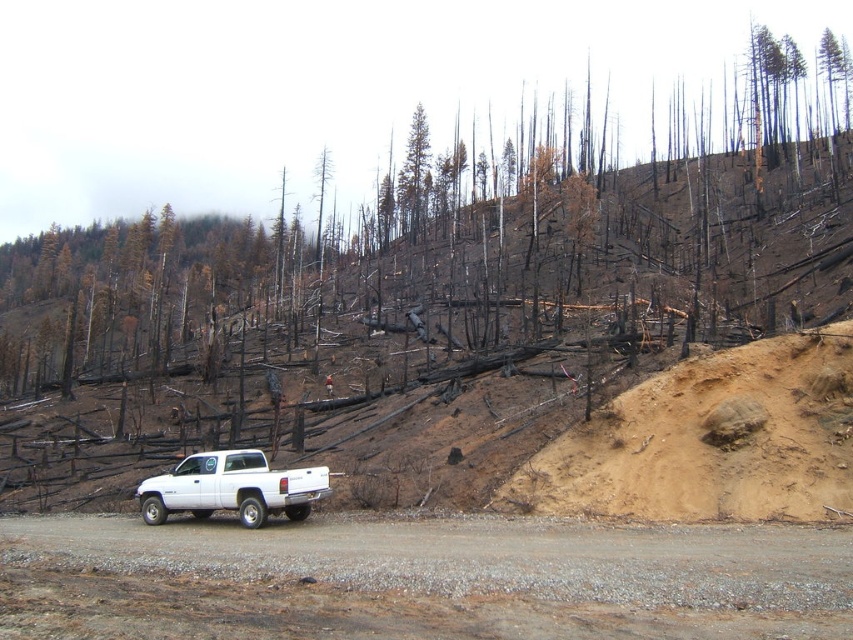
You are a firefighter assessing the area after a wildfire. You see the gray gravel road at center and the brown bark tree at center. Which object is closer to you?

The gray gravel road at center is closer because it is in front of the brown bark tree at center.

You are a firefighter assessing the fire damage in the forest. You see a point marked at coordinates [315,88] in the image. What is located at that point?

The point at coordinates [315,88] indicates burnt wood at center.